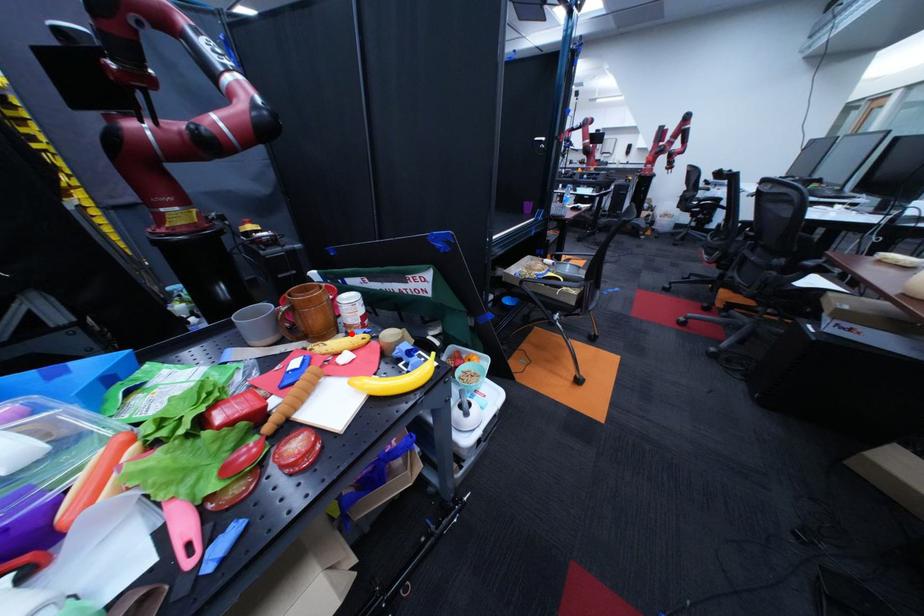
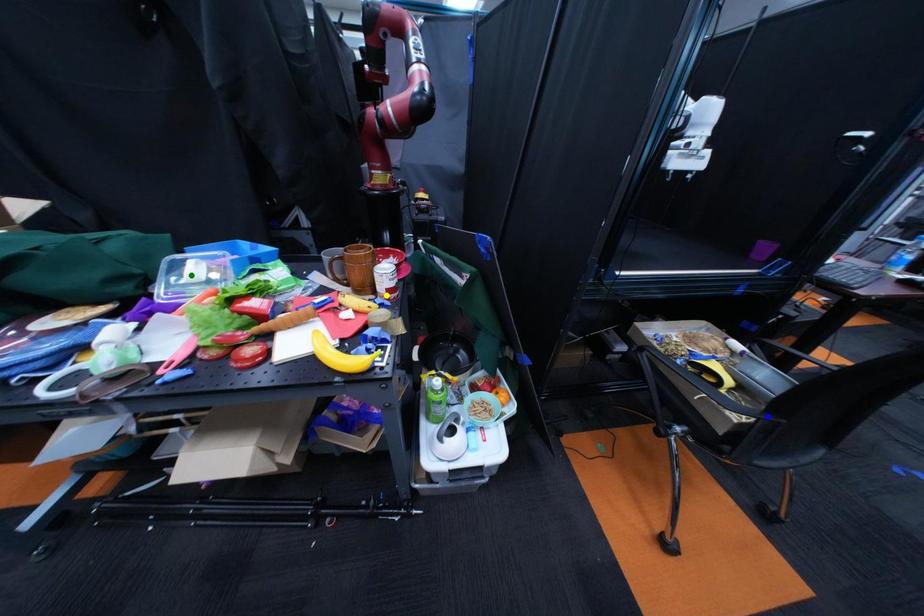
Question: I am providing you with two images of the same scene from different viewpoints. A red point is marked on the first image. You are given multiple points on the second image. Which point in image 2 is actually the same real-world point as the red point in image 1?

Choices:
 (A) green point
 (B) blue point
 (C) yellow point

Answer: (C)